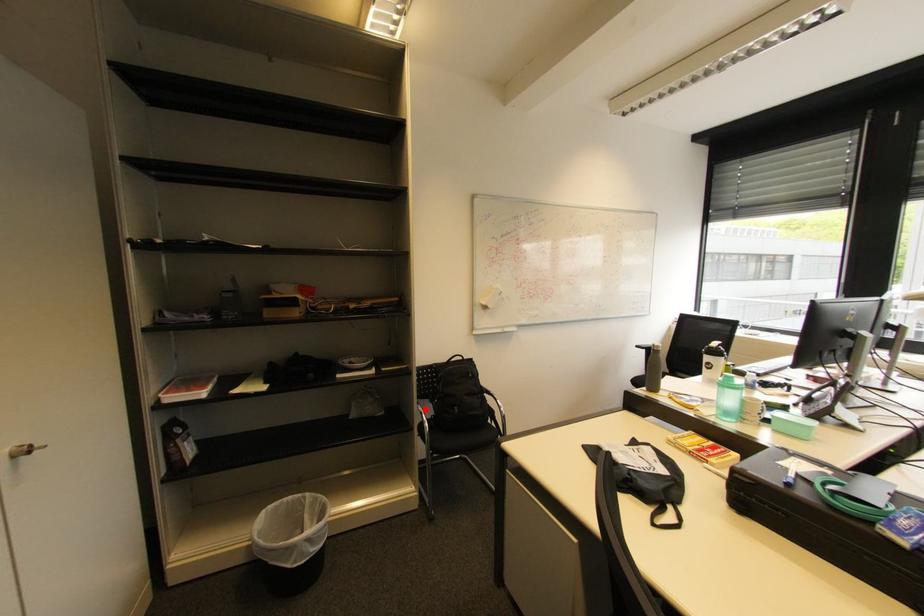
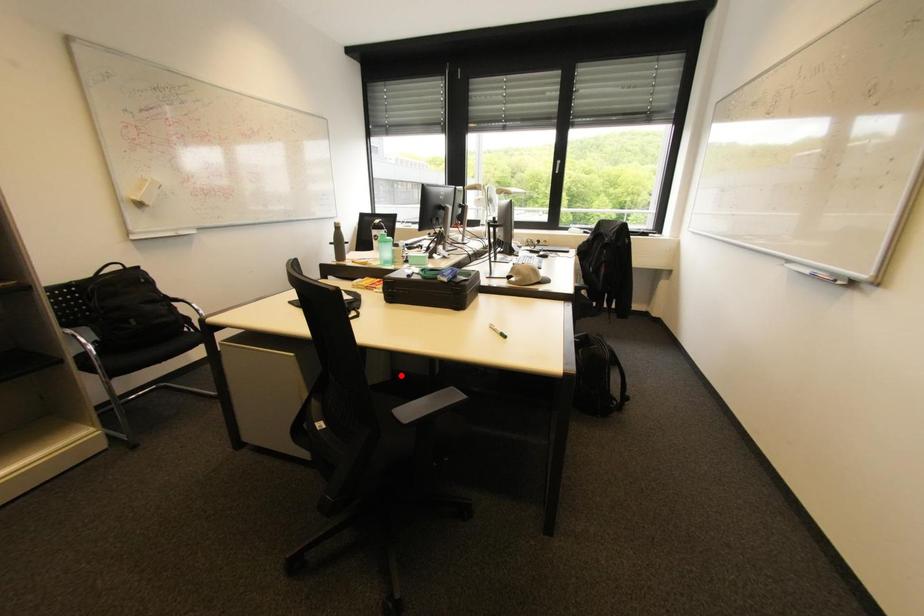
I am providing you with two images of the same scene from different viewpoints. A red point is marked on the first image and another point is marked on the second image. Do the highlighted points in image1 and image2 indicate the same real-world spot?

No